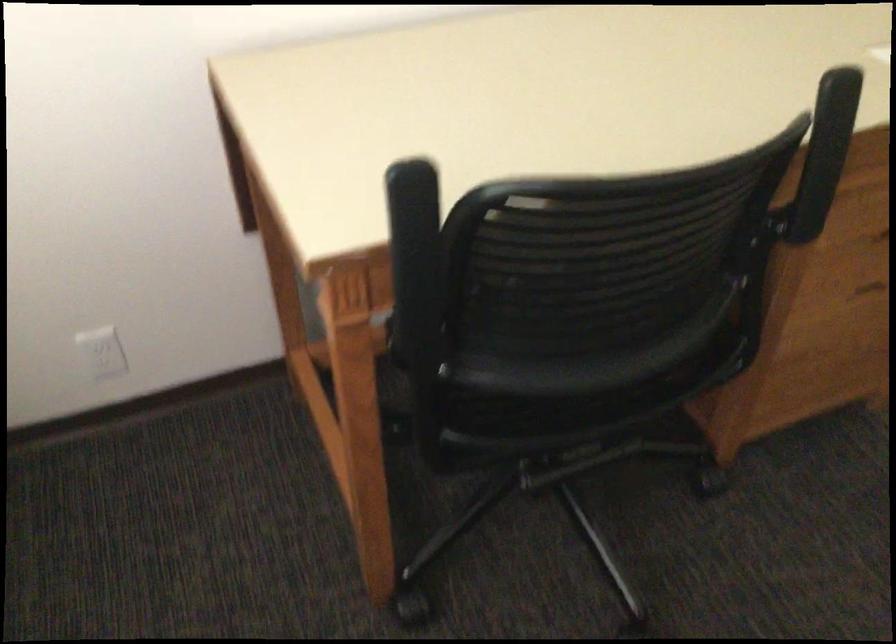
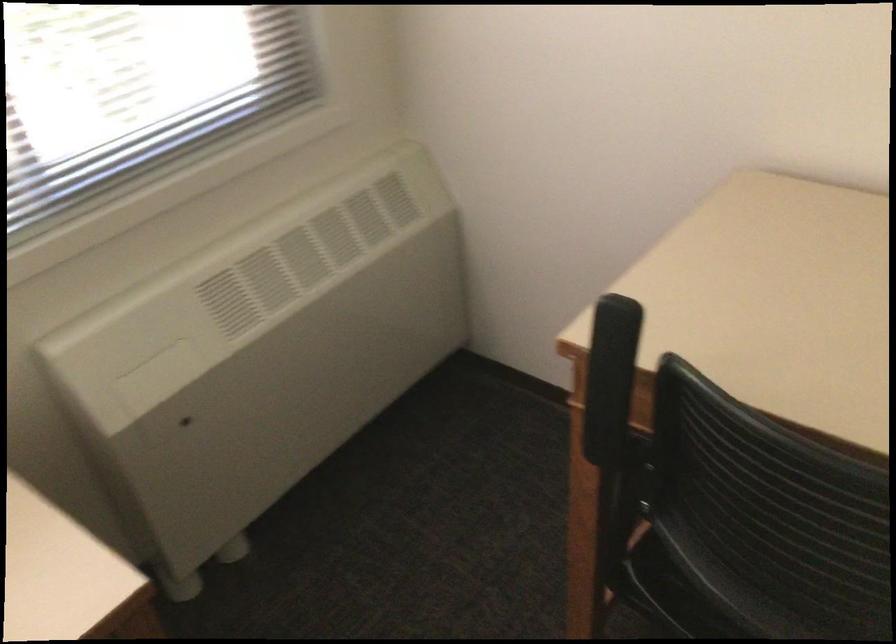
Question: The camera is either moving clockwise (left) or counter-clockwise (right) around the object. The first image is from the beginning of the video and the second image is from the end. Is the camera moving left or right when shooting the video?

Choices:
 (A) Left
 (B) Right

Answer: (B)